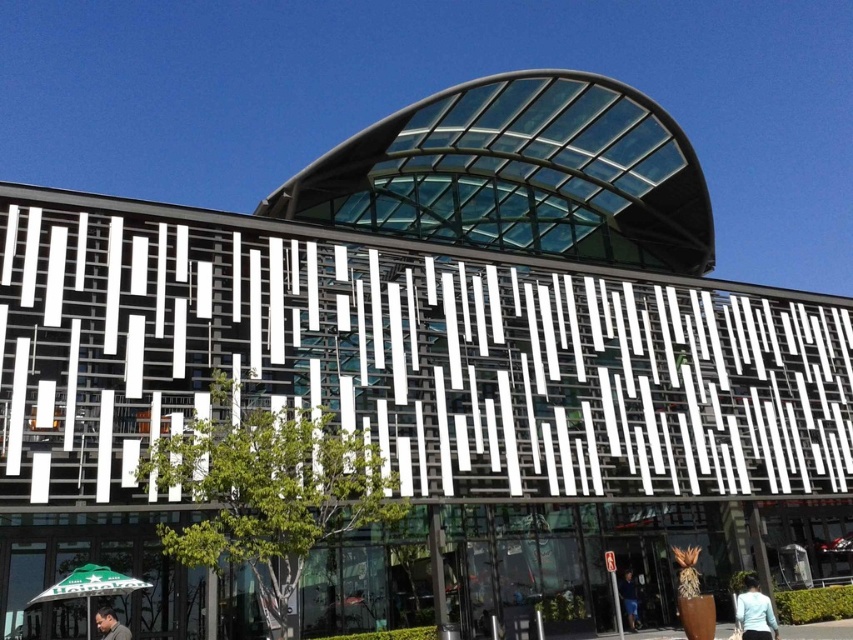
Question: Which point is farther to the camera?

Choices:
 (A) dark blue jeans at lower center
 (B) dark brown leather jacket at lower left
 (C) light blue fabric at lower right

Answer: (A)

Question: Which point is closer to the camera taking this photo?

Choices:
 (A) (88, 618)
 (B) (767, 618)

Answer: (B)

Question: Is light blue fabric at lower right positioned behind dark brown leather jacket at lower left?

Choices:
 (A) no
 (B) yes

Answer: (B)

Question: Can you confirm if light blue fabric at lower right is positioned to the left of dark brown leather jacket at lower left?

Choices:
 (A) no
 (B) yes

Answer: (A)

Question: Can you confirm if dark blue jeans at lower center is positioned below dark brown leather jacket at lower left?

Choices:
 (A) no
 (B) yes

Answer: (B)

Question: Considering the real-world distances, which object is farthest from the dark blue jeans at lower center?

Choices:
 (A) light blue fabric at lower right
 (B) green fabric umbrella at lower left
 (C) dark brown leather jacket at lower left

Answer: (C)